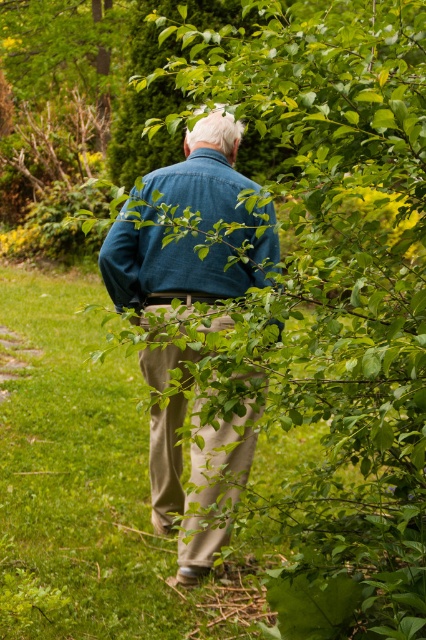
Who is lower down, green grass at center or khaki pants at center?

khaki pants at center is lower down.

Which is behind, point (48, 280) or point (181, 449)?

The point (48, 280) is more distant.

Measure the distance between point [74,385] and camera.

Point [74,385] and camera are 7.32 meters apart from each other.

Locate an element on the screen. green grass at center is located at coordinates (115, 486).

Which is behind, point (5, 472) or point (206, 444)?

The point (5, 472) is behind.

Is green grass at center shorter than denim jacket at center?

Correct, green grass at center is not as tall as denim jacket at center.

Between point (8, 416) and point (236, 182), which one is positioned behind?

The point (8, 416) is more distant.

Locate an element on the screen. The width and height of the screenshot is (426, 640). green grass at center is located at coordinates (115, 486).

Can you confirm if denim shirt at center is bigger than khaki pants at center?

No.

Between point (213, 252) and point (226, 492), which one is positioned in front?

Positioned in front is point (213, 252).

You are a GUI agent. You are given a task and a screenshot of the screen. Output one action in this format:
    pyautogui.click(x=<x>, y=<y>)
    Task: Click on the denim shirt at center
    
    Given the screenshot: What is the action you would take?
    pyautogui.click(x=167, y=266)